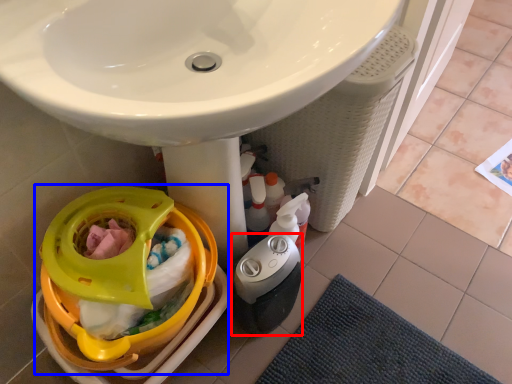
Question: Which point is closer to the camera, appliance (highlighted by a red box) or baby carriage (highlighted by a blue box)?

Choices:
 (A) appliance
 (B) baby carriage

Answer: (B)